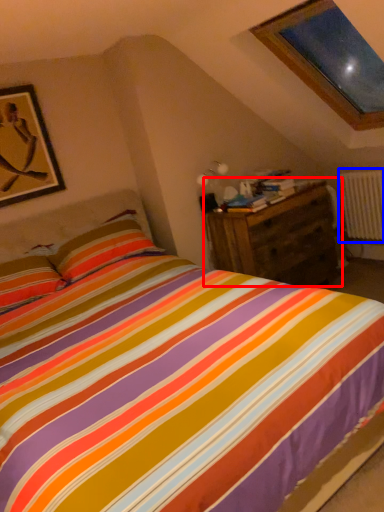
Question: Which of the following is the farthest to the observer, nightstand (highlighted by a red box) or radiator (highlighted by a blue box)?

Choices:
 (A) nightstand
 (B) radiator

Answer: (B)